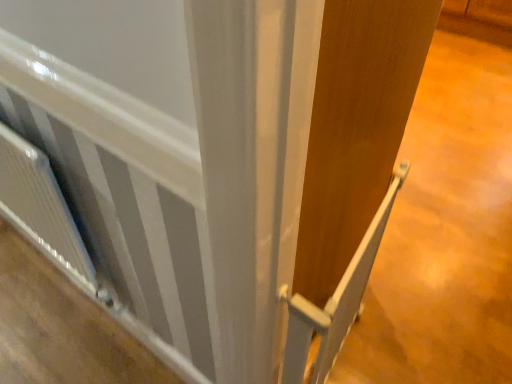
Question: Can you confirm if white plastic rail at center is thinner than white textured radiator at lower left?

Choices:
 (A) no
 (B) yes

Answer: (A)

Question: Can white textured radiator at lower left be found inside white plastic rail at center?

Choices:
 (A) yes
 (B) no

Answer: (B)

Question: Is white plastic rail at center positioned before white textured radiator at lower left?

Choices:
 (A) no
 (B) yes

Answer: (B)

Question: Is white plastic rail at center bigger than white textured radiator at lower left?

Choices:
 (A) no
 (B) yes

Answer: (A)

Question: From the image's perspective, is white plastic rail at center on top of white textured radiator at lower left?

Choices:
 (A) yes
 (B) no

Answer: (B)

Question: Can you see white plastic rail at center touching white textured radiator at lower left?

Choices:
 (A) no
 (B) yes

Answer: (A)

Question: From the image's perspective, is white textured radiator at lower left on white glossy radiator at lower left?

Choices:
 (A) no
 (B) yes

Answer: (B)

Question: Can you confirm if white textured radiator at lower left is positioned to the left of white glossy radiator at lower left?

Choices:
 (A) no
 (B) yes

Answer: (B)

Question: Is white textured radiator at lower left in front of white glossy radiator at lower left?

Choices:
 (A) yes
 (B) no

Answer: (A)

Question: From a real-world perspective, is white textured radiator at lower left located beneath white glossy radiator at lower left?

Choices:
 (A) no
 (B) yes

Answer: (A)

Question: Considering the relative positions of white textured radiator at lower left and white glossy radiator at lower left in the image provided, is white textured radiator at lower left behind white glossy radiator at lower left?

Choices:
 (A) yes
 (B) no

Answer: (B)

Question: Does white textured radiator at lower left contain white glossy radiator at lower left?

Choices:
 (A) no
 (B) yes

Answer: (A)

Question: Considering the relative sizes of white glossy radiator at lower left and white plastic rail at center in the image provided, is white glossy radiator at lower left smaller than white plastic rail at center?

Choices:
 (A) no
 (B) yes

Answer: (B)